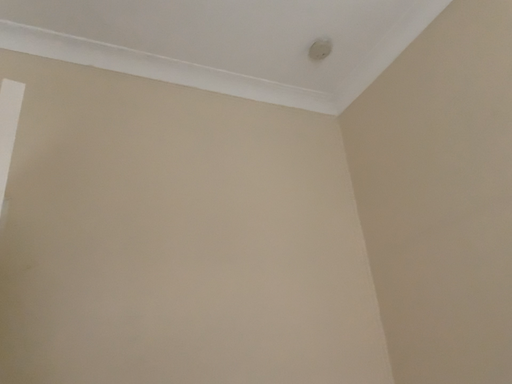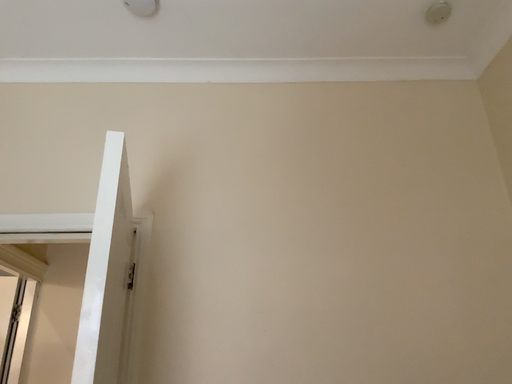
Question: How did the camera likely rotate when shooting the video?

Choices:
 (A) rotated left
 (B) rotated right

Answer: (A)